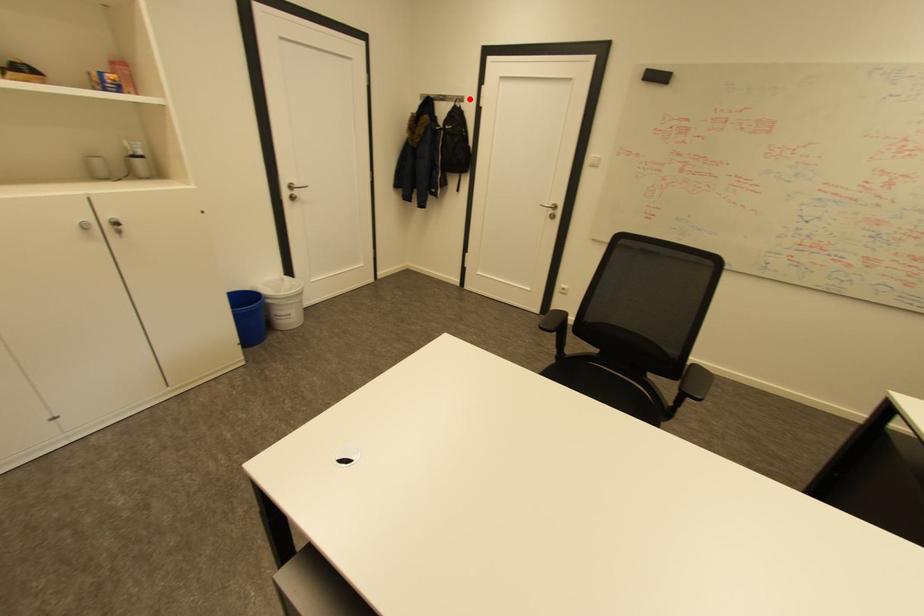
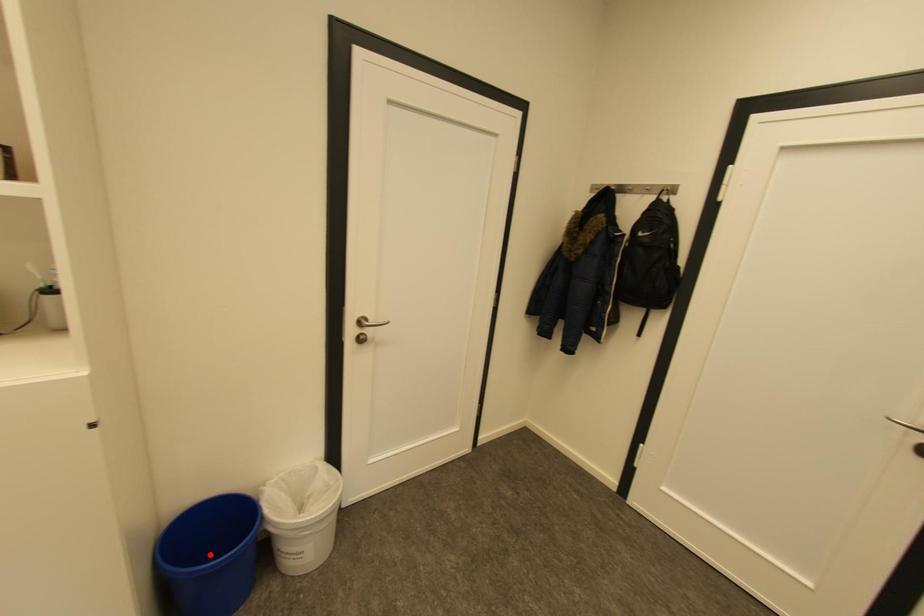
I am providing you with two images of the same scene from different viewpoints. A red point is marked on the first image and another point is marked on the second image. Is the marked point in image1 the same physical position as the marked point in image2?

No